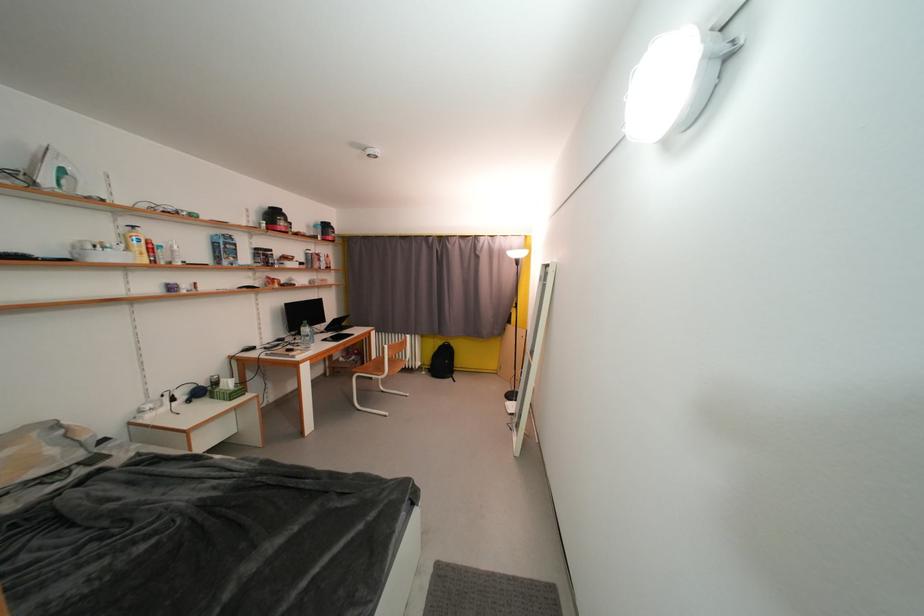
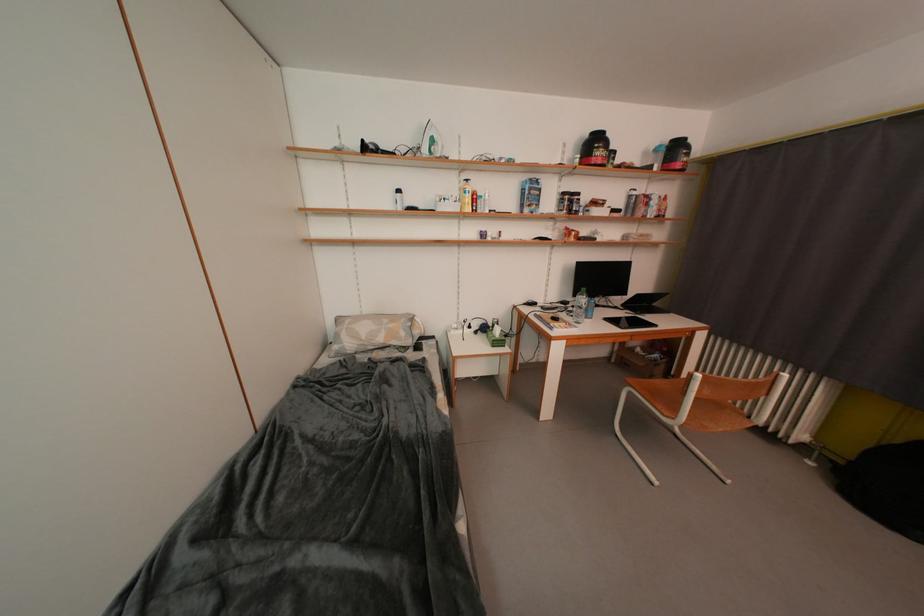
Question: How did the camera likely rotate?

Choices:
 (A) Left
 (B) Right
 (C) Up
 (D) Down

Answer: (A)